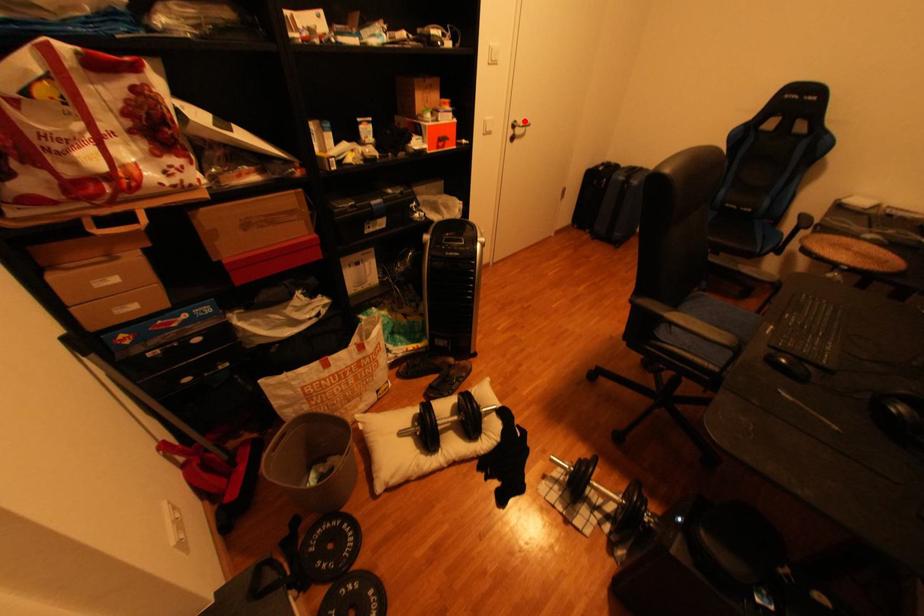
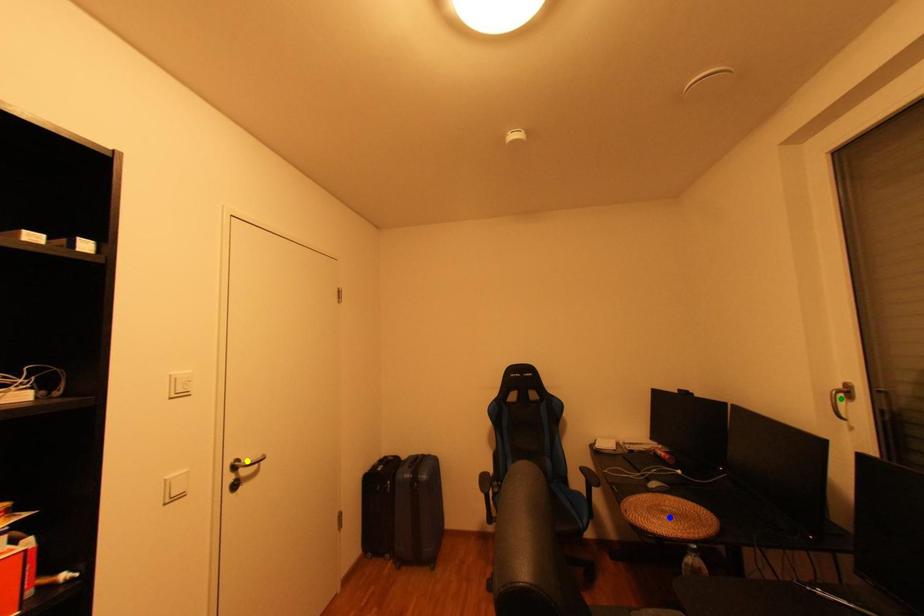
Question: I am providing you with two images of the same scene from different viewpoints. A red point is marked on the first image. You are given multiple points on the second image. Which spot in image 2 lines up with the point in image 1?

Choices:
 (A) yellow point
 (B) green point
 (C) blue point

Answer: (A)